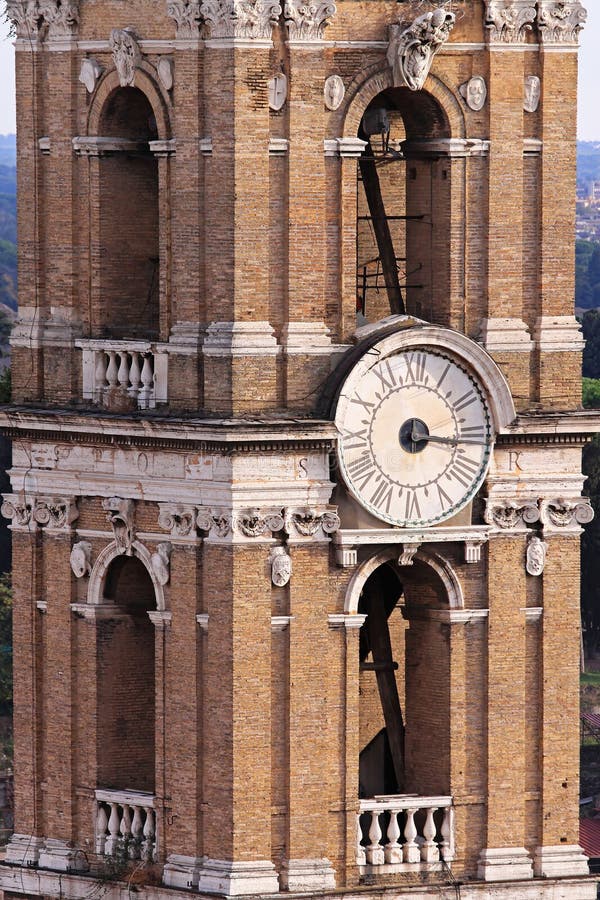
At what (x,y) coordinates should I click in order to perform the action: click on clock face. Please return your answer as a coordinate pair (x, y). The height and width of the screenshot is (900, 600). Looking at the image, I should click on (437, 415).